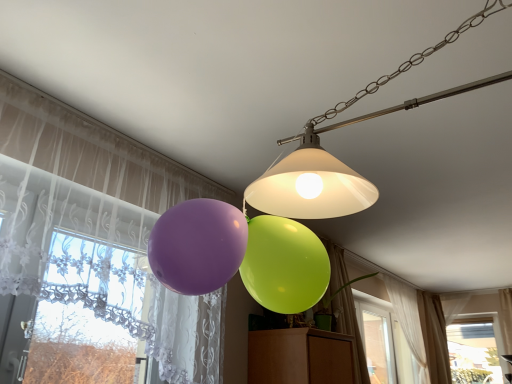
Question: Based on their sizes in the image, would you say beige sheer curtain at lower right, the 1th curtain viewed from the right, is bigger or smaller than transparent glass window at lower right?

Choices:
 (A) small
 (B) big

Answer: (B)

Question: Is beige sheer curtain at lower right, positioned as the first curtain in back-to-front order, situated inside transparent glass window at lower right or outside?

Choices:
 (A) outside
 (B) inside

Answer: (A)

Question: Which of these objects is positioned closest to the transparent glass window at lower right?

Choices:
 (A) matte white lampshade at upper center
 (B) sheer white curtain at lower right, the 3th curtain positioned from the front
 (C) green fabric curtain at lower right, arranged as the second curtain when viewed from the front
 (D) beige sheer curtain at lower right, positioned as the first curtain in back-to-front order
 (E) translucent fabric curtain at left, the 4th curtain when ordered from back to front

Answer: (D)

Question: Based on their relative distances, which object is farther from the green fabric curtain at lower right, acting as the 2th curtain starting from the left?

Choices:
 (A) matte white lampshade at upper center
 (B) sheer white curtain at lower right, which is the second curtain in right-to-left order
 (C) beige sheer curtain at lower right, positioned as the first curtain in back-to-front order
 (D) transparent glass window at lower right
 (E) translucent fabric curtain at left, the 1th curtain from the front

Answer: (D)